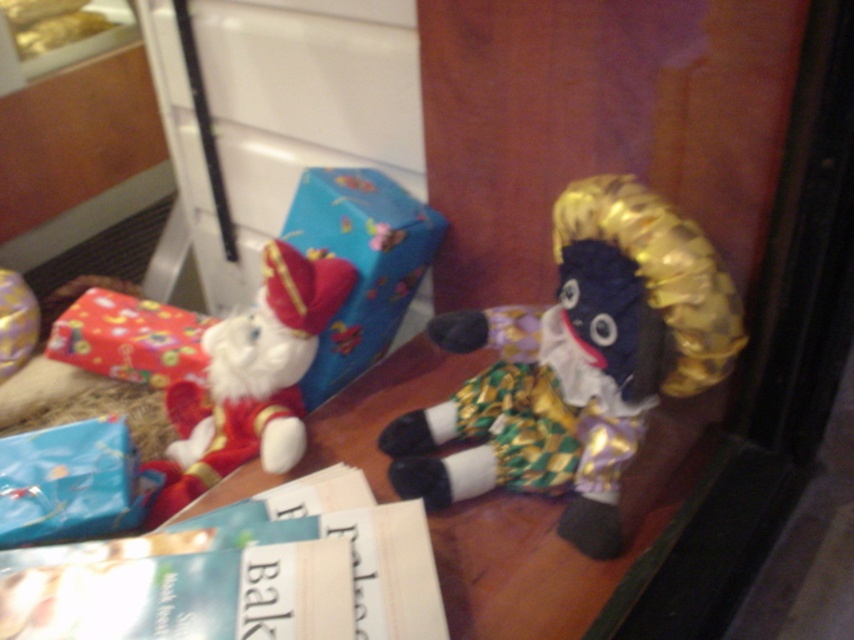
Is point (487, 385) farther from camera compared to point (63, 490)?

Yes, it is behind point (63, 490).

Who is shorter, gold textured wig at upper right or blue shiny wrapping paper at lower left?

Standing shorter between the two is blue shiny wrapping paper at lower left.

Does point (595, 486) come closer to viewer compared to point (121, 451)?

Yes.

Where is `gold textured wig at upper right`? The height and width of the screenshot is (640, 854). gold textured wig at upper right is located at coordinates (577, 364).

Which is below, shiny blue wrapping paper at center or shiny red wrapping paper at left?

shiny red wrapping paper at left is lower down.

Who is more distant from viewer, (x=320, y=214) or (x=74, y=339)?

Point (x=74, y=339)

Find the location of a particular element. This screenshot has height=640, width=854. shiny blue wrapping paper at center is located at coordinates (360, 262).

Does blue shiny wrapping paper at lower left have a greater height compared to shiny red wrapping paper at left?

In fact, blue shiny wrapping paper at lower left may be shorter than shiny red wrapping paper at left.

Between blue shiny wrapping paper at lower left and shiny red wrapping paper at left, which one appears on the left side from the viewer's perspective?

From the viewer's perspective, shiny red wrapping paper at left appears more on the left side.

Is point (91, 460) more distant than point (151, 385)?

No, it is in front of (151, 385).

At what (x,y) coordinates should I click in order to perform the action: click on blue shiny wrapping paper at lower left. Please return your answer as a coordinate pair (x, y). This screenshot has width=854, height=640. Looking at the image, I should click on (69, 483).